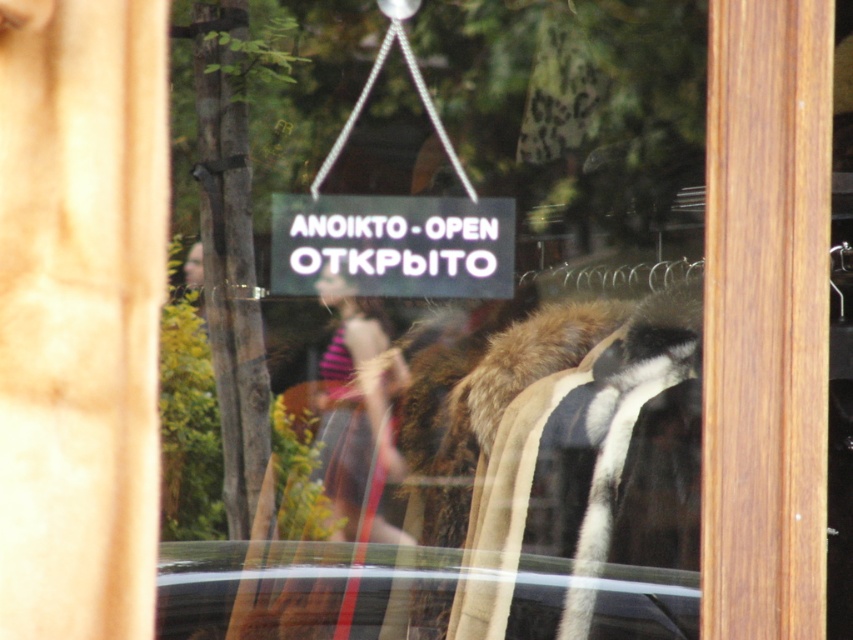
Is black plastic sign at center to the left of striped fabric at center from the viewer's perspective?

Incorrect, black plastic sign at center is not on the left side of striped fabric at center.

Identify the location of black plastic sign at center. This screenshot has width=853, height=640. (393, 244).

Find the location of a particular element. The height and width of the screenshot is (640, 853). black plastic sign at center is located at coordinates (393, 244).

Is fur coat at center shorter than black plastic sign at center?

No.

Between point (491, 525) and point (509, 268), which one is positioned behind?

Positioned behind is point (491, 525).

Describe the element at coordinates (567, 468) in the screenshot. I see `fur coat at center` at that location.

Where is `fur coat at center`? The image size is (853, 640). fur coat at center is located at coordinates (567, 468).

The width and height of the screenshot is (853, 640). Describe the element at coordinates (567, 468) in the screenshot. I see `fur coat at center` at that location.

Does fur coat at center appear over striped fabric at center?

Actually, fur coat at center is below striped fabric at center.

Is point (541, 349) positioned after point (335, 410)?

Yes.

This screenshot has height=640, width=853. Identify the location of fur coat at center. (567, 468).